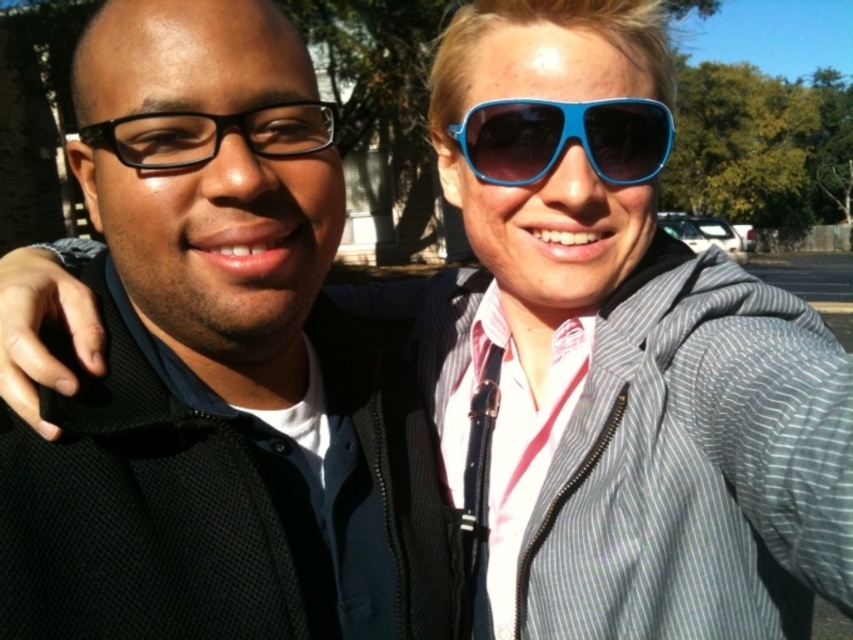
Looking at this image, you are a photographer trying to capture a closeup shot of both the blue plastic sunglasses at upper center and the black plastic glasses at left in the image. The camera you are using has a maximum focus range of 18 inches. Will you be able to focus on both objects simultaneously?

The blue plastic sunglasses at upper center and the black plastic glasses at left are 18.61 inches apart from each other. Since the camera can only focus within 18 inches, the distance between them exceeds the maximum focus range. Therefore, you cannot focus on both objects simultaneously.

You are a photographer trying to capture a closeup of the blue plastic sunglasses at upper center without the black matte jacket at center appearing too large in the frame. Which object should you focus on to ensure the sunglasses are the main subject?

The black matte jacket at center is larger than the blue plastic sunglasses at upper center, so focusing on the blue plastic sunglasses at upper center will help make them the main subject while minimizing the prominence of the larger jacket in the frame.

You are a photographer trying to capture a clear shot of both the blue plastic sunglasses at upper center and the black plastic glasses at left. Since you want to ensure both are visible in the frame, which object should you focus on first to account for their sizes?

The blue plastic sunglasses at upper center is taller than the black plastic glasses at left, so you should focus on the blue plastic sunglasses at upper center first to ensure its larger size is properly captured in the frame.